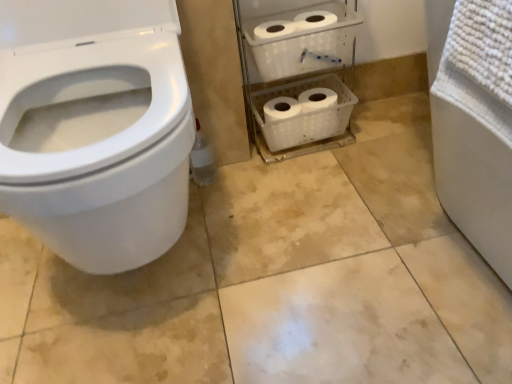
Question: From the image's perspective, is white glossy toilet at left located above white plastic shelf at center?

Choices:
 (A) yes
 (B) no

Answer: (B)

Question: Does white glossy toilet at left lie in front of white plastic shelf at center?

Choices:
 (A) no
 (B) yes

Answer: (B)

Question: Is white plastic shelf at center a part of white glossy toilet at left?

Choices:
 (A) yes
 (B) no

Answer: (B)

Question: Considering the relative positions of white glossy toilet at left and white plastic shelf at center in the image provided, is white glossy toilet at left to the left of white plastic shelf at center from the viewer's perspective?

Choices:
 (A) no
 (B) yes

Answer: (B)

Question: Is white plastic shelf at center at the back of white glossy toilet at left?

Choices:
 (A) no
 (B) yes

Answer: (A)

Question: Can you confirm if white glossy toilet at left is bigger than white plastic shelf at center?

Choices:
 (A) no
 (B) yes

Answer: (B)

Question: Is white plastic shelf at center taller than white glossy toilet at left?

Choices:
 (A) no
 (B) yes

Answer: (A)

Question: Does white plastic shelf at center come in front of white glossy toilet at left?

Choices:
 (A) yes
 (B) no

Answer: (B)

Question: Considering the relative sizes of white plastic shelf at center and white glossy toilet at left in the image provided, is white plastic shelf at center bigger than white glossy toilet at left?

Choices:
 (A) yes
 (B) no

Answer: (B)

Question: Does white plastic shelf at center have a lesser width compared to white glossy toilet at left?

Choices:
 (A) no
 (B) yes

Answer: (B)

Question: Is white plastic shelf at center not inside white glossy toilet at left?

Choices:
 (A) no
 (B) yes

Answer: (B)

Question: Considering the relative positions of white plastic shelf at center and white glossy toilet at left in the image provided, is white plastic shelf at center behind white glossy toilet at left?

Choices:
 (A) no
 (B) yes

Answer: (B)

Question: From a real-world perspective, is white plastic shelf at center positioned above or below white glossy toilet at left?

Choices:
 (A) above
 (B) below

Answer: (B)